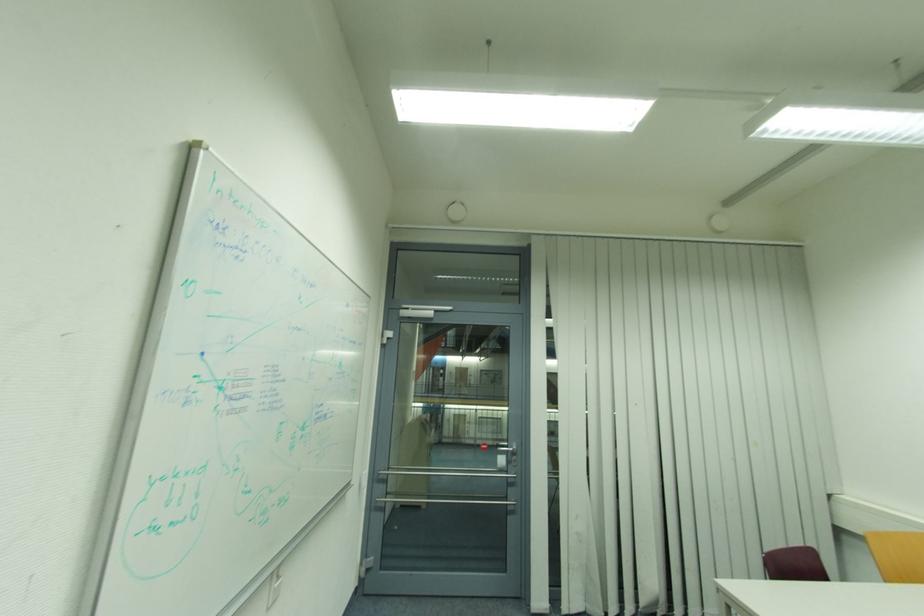
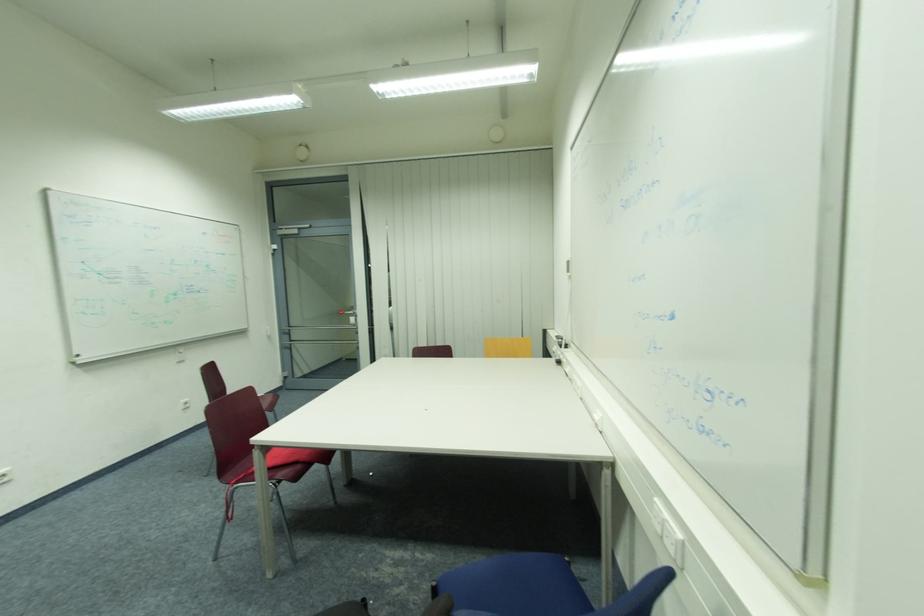
Which direction would the cameraman need to move to produce the second image?

The cameraman walked toward right, backward.